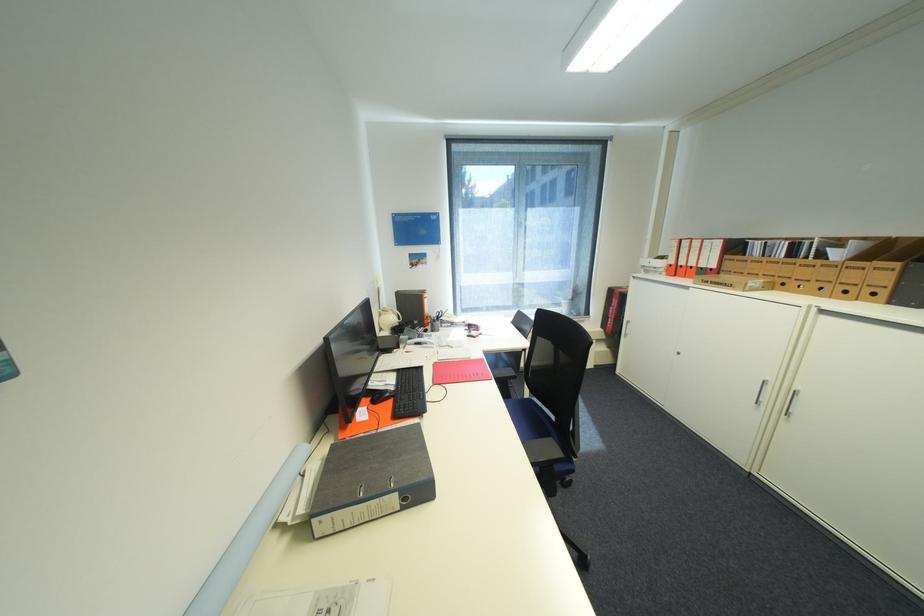
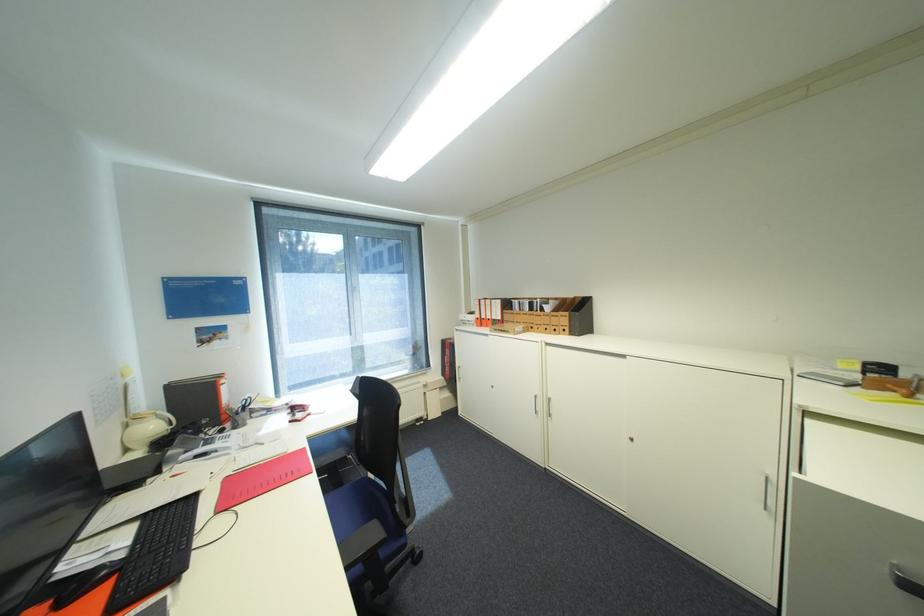
Question: The camera is either moving clockwise (left) or counter-clockwise (right) around the object. The first image is from the beginning of the video and the second image is from the end. Is the camera moving left or right when shooting the video?

Choices:
 (A) Left
 (B) Right

Answer: (A)